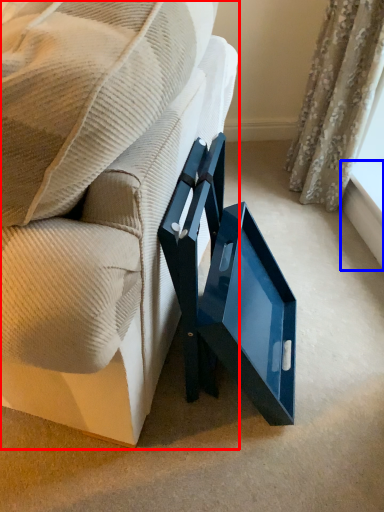
Question: Which object appears closest to the camera in this image, furniture (highlighted by a red box) or window sill (highlighted by a blue box)?

Choices:
 (A) furniture
 (B) window sill

Answer: (A)